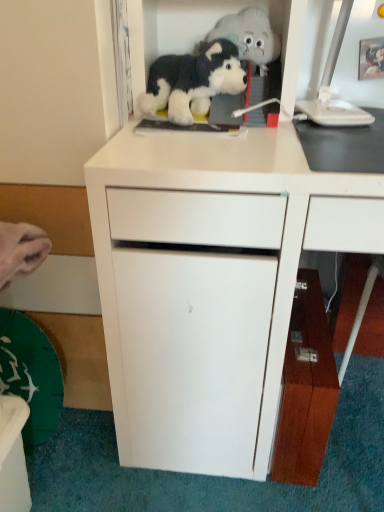
Question: Visually, is wooden cabinet at lower right, the second cabinetry viewed from the left, positioned to the left or to the right of white matte cabinet at center, which is the 2th cabinetry from right to left?

Choices:
 (A) right
 (B) left

Answer: (A)

Question: Is wooden cabinet at lower right, the second cabinetry viewed from the left, inside the boundaries of white matte cabinet at center, the first cabinetry when ordered from left to right, or outside?

Choices:
 (A) outside
 (B) inside

Answer: (B)

Question: Which of these objects is positioned farthest from the wooden cabinet at lower right, arranged as the 1th cabinetry when viewed from the right?

Choices:
 (A) black plush dog at upper center, placed as the 1th toy when sorted from bottom to top
 (B) white plastic computer monitor at upper right
 (C) fluffy plush toy at upper center, acting as the 2th toy starting from the bottom
 (D) white matte cabinet at center, which is the 2th cabinetry from right to left

Answer: (A)

Question: Considering the real-world distances, which object is closest to the wooden cabinet at lower right, the second cabinetry viewed from the left?

Choices:
 (A) black plush dog at upper center, placed as the 1th toy when sorted from bottom to top
 (B) white matte cabinet at center, which is the 2th cabinetry from right to left
 (C) fluffy plush toy at upper center, acting as the 2th toy starting from the bottom
 (D) white plastic computer monitor at upper right

Answer: (B)